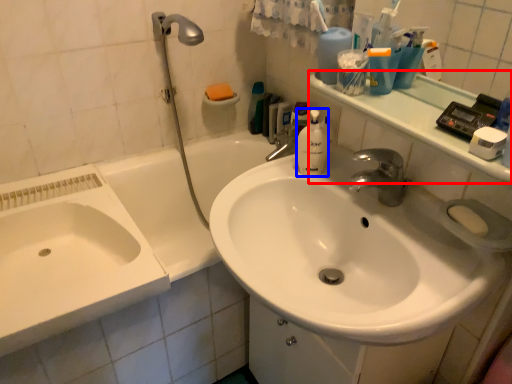
Question: Which of the following is the farthest to the observer, counter top (highlighted by a red box) or cleaning product (highlighted by a blue box)?

Choices:
 (A) counter top
 (B) cleaning product

Answer: (B)